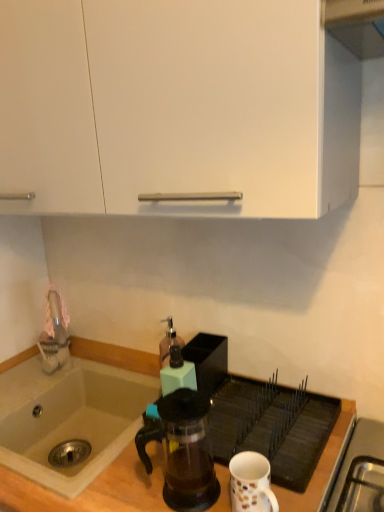
This screenshot has width=384, height=512. Find the location of `vacant area that is in front of translucent glass soap dispenser at center, arranged as the 2th kitchen appliance when viewed from the front`. vacant area that is in front of translucent glass soap dispenser at center, arranged as the 2th kitchen appliance when viewed from the front is located at coordinates (199, 413).